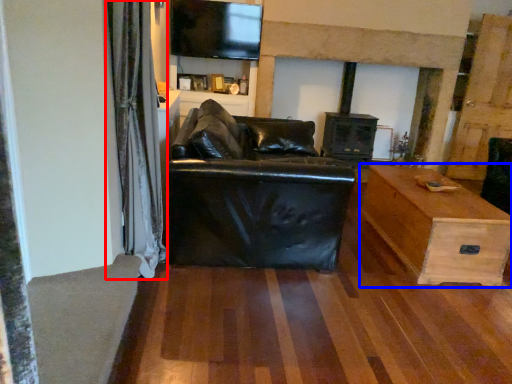
Question: Which object is further to the camera taking this photo, curtain (highlighted by a red box) or table (highlighted by a blue box)?

Choices:
 (A) curtain
 (B) table

Answer: (B)